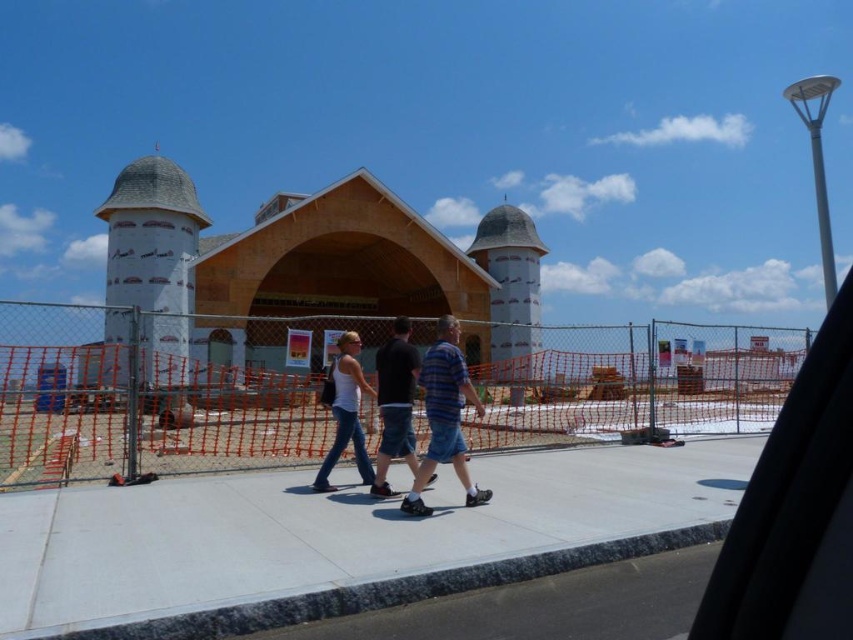
In the scene shown: Can you confirm if striped cotton shirt at center is positioned to the right of dark blue denim shorts at center?

Indeed, striped cotton shirt at center is positioned on the right side of dark blue denim shorts at center.

At what (x,y) coordinates should I click in order to perform the action: click on striped cotton shirt at center. Please return your answer as a coordinate pair (x, y). The width and height of the screenshot is (853, 640). Looking at the image, I should click on (444, 417).

Between point (836, 328) and point (447, 316), which one is positioned behind?

Positioned behind is point (447, 316).

Does point (821, 609) come behind point (421, 500)?

No, (821, 609) is in front of (421, 500).

What do you see at coordinates (793, 509) in the screenshot?
I see `transparent glass car window at upper right` at bounding box center [793, 509].

Image resolution: width=853 pixels, height=640 pixels. Identify the location of transparent glass car window at upper right. (793, 509).

Does gray concrete sidewalk at center have a lesser width compared to transparent glass car window at upper right?

Correct, gray concrete sidewalk at center's width is less than transparent glass car window at upper right's.

Can you confirm if gray concrete sidewalk at center is smaller than transparent glass car window at upper right?

Correct, gray concrete sidewalk at center occupies less space than transparent glass car window at upper right.

Which is behind, point (39, 616) or point (712, 573)?

The point (39, 616) is more distant.

Locate an element on the screen. The height and width of the screenshot is (640, 853). gray concrete sidewalk at center is located at coordinates (338, 531).